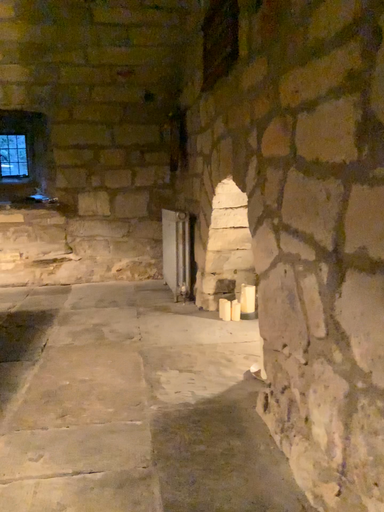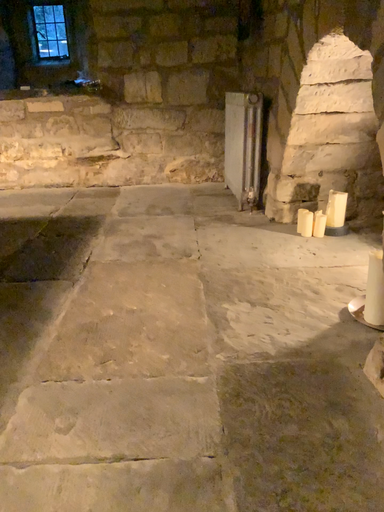
Question: How did the camera likely rotate when shooting the video?

Choices:
 (A) rotated right
 (B) rotated left

Answer: (B)